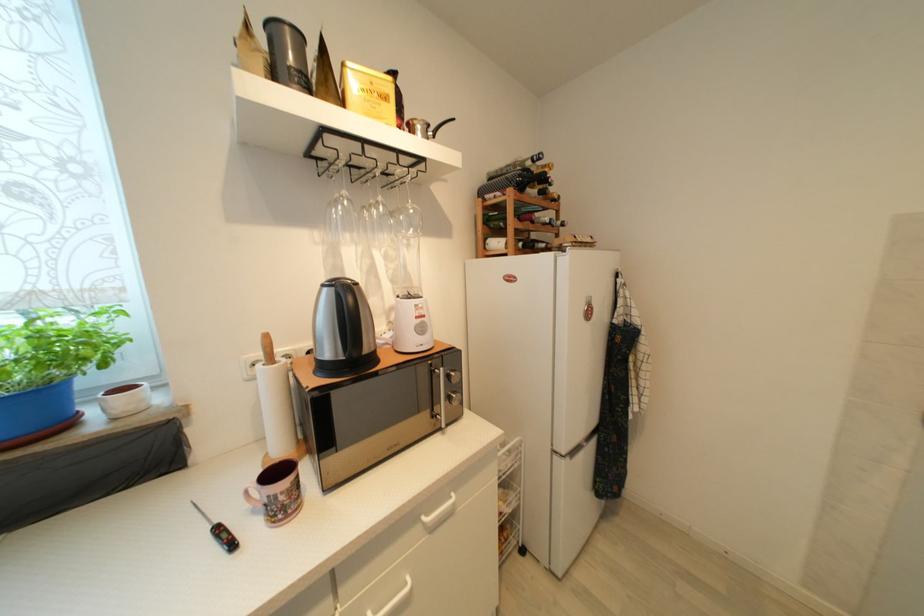
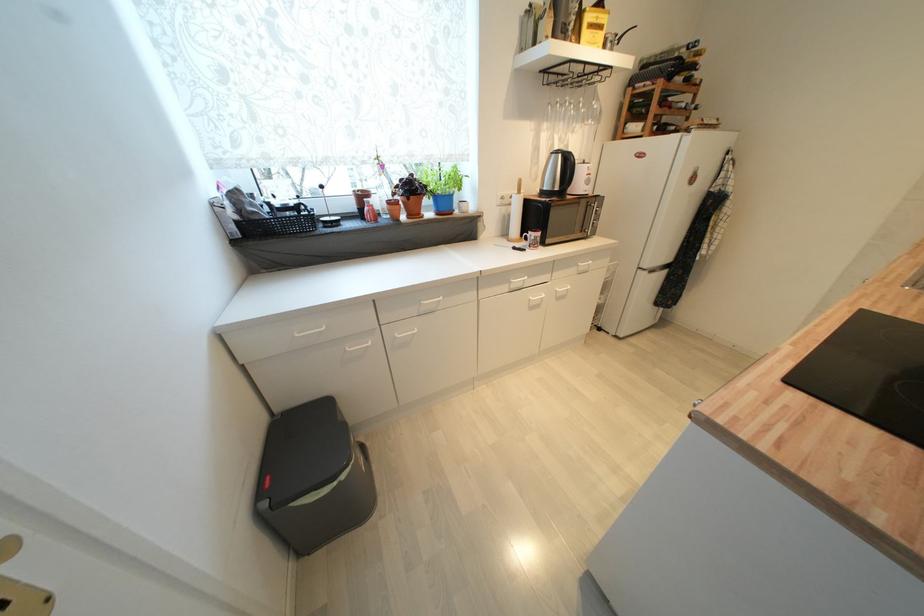
Locate, in the second image, the point that corresponds to the point at 562,245 in the first image.

(690, 127)